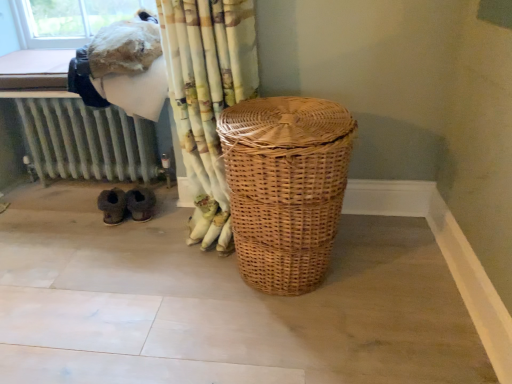
Question: Is patterned fabric curtain at center to the left or to the right of metallic radiator at lower left in the image?

Choices:
 (A) right
 (B) left

Answer: (A)

Question: From the image's perspective, is patterned fabric curtain at center positioned above or below metallic radiator at lower left?

Choices:
 (A) above
 (B) below

Answer: (A)

Question: Which of these objects is positioned farthest from the brown suede slippers at lower left?

Choices:
 (A) woven brown laundry basket at center
 (B) metallic radiator at lower left
 (C) patterned fabric curtain at center

Answer: (A)

Question: Which of these objects is positioned farthest from the brown suede slippers at lower left?

Choices:
 (A) patterned fabric curtain at center
 (B) metallic radiator at lower left
 (C) woven brown laundry basket at center

Answer: (C)